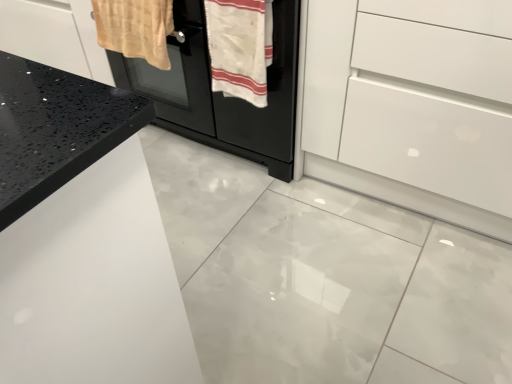
Question: In terms of size, does white cotton towel at center, marked as the 2th bath towel in a left-to-right arrangement, appear bigger or smaller than beige woven towel at upper left, positioned as the second bath towel in right-to-left order?

Choices:
 (A) big
 (B) small

Answer: (B)

Question: Is point (249, 31) closer or farther from the camera than point (169, 66)?

Choices:
 (A) closer
 (B) farther

Answer: (A)

Question: Estimate the real-world distances between objects in this image. Which object is closer to the black matte oven at center?

Choices:
 (A) white cotton towel at center, marked as the 2th bath towel in a left-to-right arrangement
 (B) beige woven towel at upper left, which is the 1th bath towel from left to right
 (C) white glossy drawer at center

Answer: (A)

Question: Which of these objects is positioned farthest from the black matte oven at center?

Choices:
 (A) beige woven towel at upper left, which is the 1th bath towel from left to right
 (B) white glossy drawer at center
 (C) white cotton towel at center, the first bath towel in the right-to-left sequence

Answer: (B)